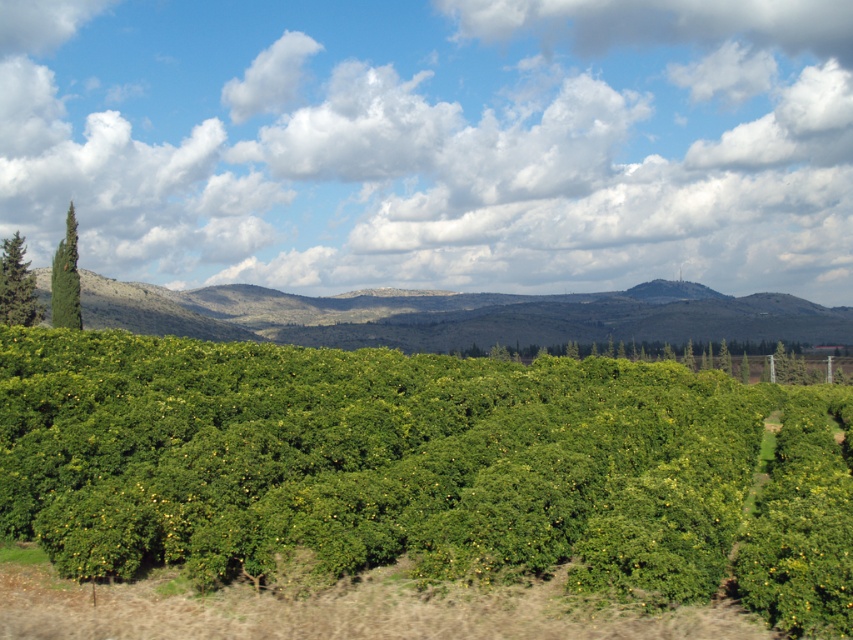
Question: Can you confirm if cloudy sky at upper center is bigger than green textured tree at upper left?

Choices:
 (A) yes
 (B) no

Answer: (A)

Question: Which is nearer to the green leafy hillside at center?

Choices:
 (A) green textured tree at upper left
 (B) green leafy tree at left
 (C) green leafy hedge at center

Answer: (C)

Question: Among these objects, which one is nearest to the camera?

Choices:
 (A) green leafy tree at left
 (B) green textured tree at upper left
 (C) green leafy hillside at center
 (D) green leafy hedge at center

Answer: (D)

Question: Does green leafy hillside at center appear on the right side of green leafy tree at left?

Choices:
 (A) no
 (B) yes

Answer: (B)

Question: Can you confirm if cloudy sky at upper center is bigger than green textured tree at upper left?

Choices:
 (A) no
 (B) yes

Answer: (B)

Question: Which point is farther from the camera taking this photo?

Choices:
 (A) (70, 296)
 (B) (10, 259)
 (C) (122, 339)
 (D) (753, 218)

Answer: (D)